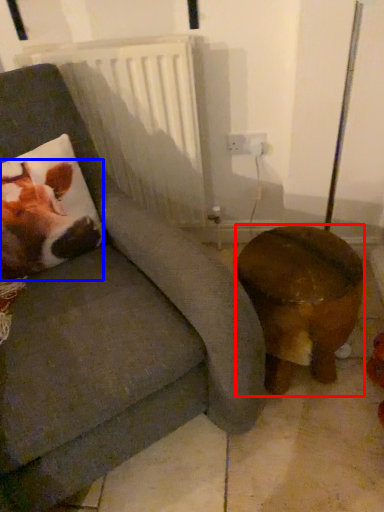
Question: Which point is closer to the camera, furniture (highlighted by a red box) or animal (highlighted by a blue box)?

Choices:
 (A) furniture
 (B) animal

Answer: (A)